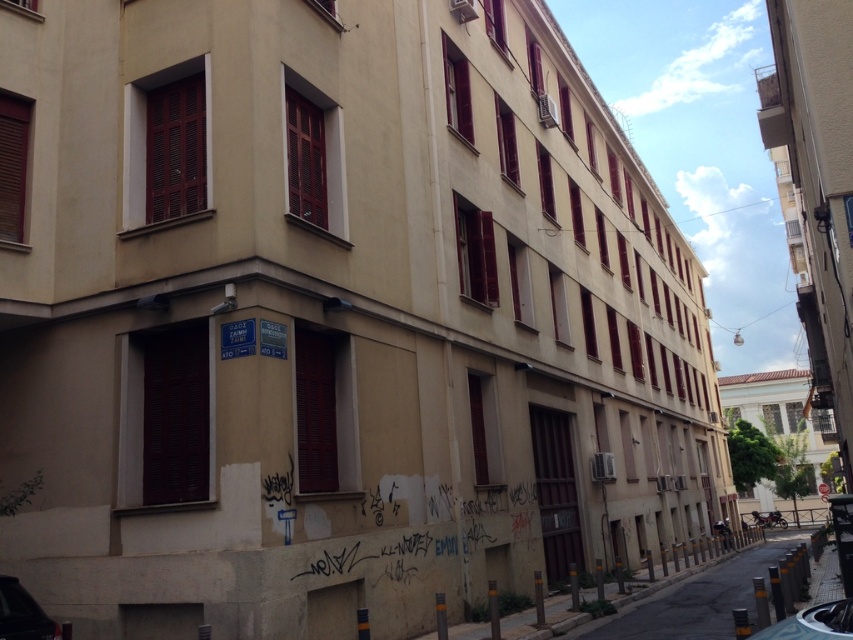
In the scene shown: Does shiny black car at lower left have a lesser width compared to silver metallic car at lower right?

In fact, shiny black car at lower left might be wider than silver metallic car at lower right.

Does shiny black car at lower left have a greater height compared to silver metallic car at lower right?

Yes.

Is point (10, 586) closer to viewer compared to point (837, 611)?

No, it is behind (837, 611).

You are a GUI agent. You are given a task and a screenshot of the screen. Output one action in this format:
    pyautogui.click(x=<x>, y=<y>)
    Task: Click on the shiny black car at lower left
    The width and height of the screenshot is (853, 640).
    Given the screenshot: What is the action you would take?
    pyautogui.click(x=24, y=614)

Is point (688, 611) closer to camera compared to point (805, 612)?

No, it is behind (805, 612).

Can you confirm if concrete sidewalk at lower right is smaller than silver metallic car at lower right?

No, concrete sidewalk at lower right is not smaller than silver metallic car at lower right.

Find the location of a particular element. This screenshot has height=640, width=853. concrete sidewalk at lower right is located at coordinates (695, 600).

Which is more to the left, concrete sidewalk at lower right or shiny black car at lower left?

Positioned to the left is shiny black car at lower left.

Can you confirm if concrete sidewalk at lower right is shorter than shiny black car at lower left?

Incorrect, concrete sidewalk at lower right's height does not fall short of shiny black car at lower left's.

Where is `concrete sidewalk at lower right`? concrete sidewalk at lower right is located at coordinates (695, 600).